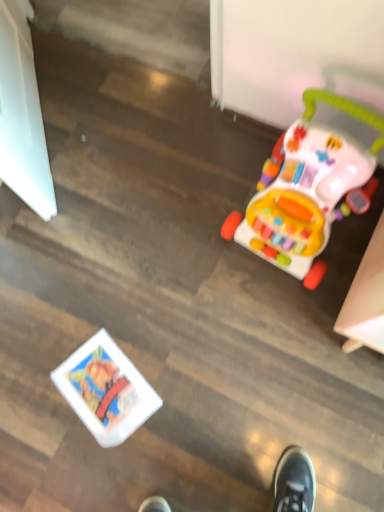
Find the location of a particular element. This screenshot has height=512, width=384. white glossy book at lower left, the 1th toy from the bottom is located at coordinates (106, 390).

Describe the element at coordinates (106, 390) in the screenshot. I see `white glossy book at lower left, the 1th toy from the bottom` at that location.

Image resolution: width=384 pixels, height=512 pixels. What are the coordinates of `multicolored plastic walker at right, which appears as the 2th toy when ordered from the bottom` in the screenshot? It's located at (308, 189).

What do you see at coordinates (308, 189) in the screenshot?
I see `multicolored plastic walker at right, the first toy from the right` at bounding box center [308, 189].

What is the approximate height of multicolored plastic walker at right, which ranks as the 2th toy in left-to-right order?

multicolored plastic walker at right, which ranks as the 2th toy in left-to-right order, is 17.11 inches tall.

You are a GUI agent. You are given a task and a screenshot of the screen. Output one action in this format:
    pyautogui.click(x=<x>, y=<y>)
    Task: Click on the white glossy book at lower left, which is the 2th toy from right to left
    
    Given the screenshot: What is the action you would take?
    pyautogui.click(x=106, y=390)

Which object is positioned more to the right, multicolored plastic walker at right, the first toy from the right, or white glossy book at lower left, the 1th toy from the bottom?

From the viewer's perspective, multicolored plastic walker at right, the first toy from the right, appears more on the right side.

Is the depth of multicolored plastic walker at right, the first toy from the right, greater than that of white glossy book at lower left, which is the 2th toy from right to left?

That is False.

Which point is more distant from viewer, (319,214) or (87,366)?

Point (87,366)

From the image's perspective, is multicolored plastic walker at right, positioned as the first toy in top-to-bottom order, on top of white glossy book at lower left, the second toy from the top?

Yes, from the image's perspective, multicolored plastic walker at right, positioned as the first toy in top-to-bottom order, is over white glossy book at lower left, the second toy from the top.

From a real-world perspective, is multicolored plastic walker at right, which ranks as the 2th toy in left-to-right order, above or below white glossy book at lower left, the second toy from the top?

multicolored plastic walker at right, which ranks as the 2th toy in left-to-right order, is situated higher than white glossy book at lower left, the second toy from the top, in the real world.

Is multicolored plastic walker at right, which appears as the 2th toy when ordered from the bottom, wider or thinner than white glossy book at lower left, the 1th toy from the bottom?

In the image, multicolored plastic walker at right, which appears as the 2th toy when ordered from the bottom, appears to be wider than white glossy book at lower left, the 1th toy from the bottom.

Between multicolored plastic walker at right, which appears as the 2th toy when ordered from the bottom, and white glossy book at lower left, which is the 2th toy from right to left, which one has less height?

Standing shorter between the two is white glossy book at lower left, which is the 2th toy from right to left.

Considering the relative sizes of multicolored plastic walker at right, the first toy from the right, and white glossy book at lower left, the second toy from the top, in the image provided, is multicolored plastic walker at right, the first toy from the right, smaller than white glossy book at lower left, the second toy from the top,?

Incorrect, multicolored plastic walker at right, the first toy from the right, is not smaller in size than white glossy book at lower left, the second toy from the top.

Can white glossy book at lower left, the second toy from the top, be found inside multicolored plastic walker at right, which appears as the 2th toy when ordered from the bottom?

No, white glossy book at lower left, the second toy from the top, is not a part of multicolored plastic walker at right, which appears as the 2th toy when ordered from the bottom.

Would you say multicolored plastic walker at right, which ranks as the 2th toy in left-to-right order, is a long distance from white glossy book at lower left, arranged as the first toy when viewed from the left?

No, multicolored plastic walker at right, which ranks as the 2th toy in left-to-right order, is in close proximity to white glossy book at lower left, arranged as the first toy when viewed from the left.

Is multicolored plastic walker at right, positioned as the first toy in top-to-bottom order, aimed at white glossy book at lower left, which is the 2th toy from right to left?

Yes, multicolored plastic walker at right, positioned as the first toy in top-to-bottom order, faces towards white glossy book at lower left, which is the 2th toy from right to left.

The height and width of the screenshot is (512, 384). In order to click on toy located underneath the multicolored plastic walker at right, which appears as the 2th toy when ordered from the bottom (from a real-world perspective) in this screenshot , I will do `click(106, 390)`.

Which object is positioned more to the left, white glossy book at lower left, the second toy from the top, or multicolored plastic walker at right, which appears as the 2th toy when ordered from the bottom?

From the viewer's perspective, white glossy book at lower left, the second toy from the top, appears more on the left side.

Considering the relative positions of white glossy book at lower left, which is the 2th toy from right to left, and multicolored plastic walker at right, positioned as the first toy in top-to-bottom order, in the image provided, is white glossy book at lower left, which is the 2th toy from right to left, behind multicolored plastic walker at right, positioned as the first toy in top-to-bottom order,?

Yes, white glossy book at lower left, which is the 2th toy from right to left, is further from the camera.

Considering the points (109, 345) and (264, 164), which point is behind, point (109, 345) or point (264, 164)?

Positioned behind is point (109, 345).

From the image's perspective, relative to multicolored plastic walker at right, the first toy from the right, is white glossy book at lower left, the 1th toy from the bottom, above or below?

Clearly, from the image's perspective, white glossy book at lower left, the 1th toy from the bottom, is below multicolored plastic walker at right, the first toy from the right.

From a real-world perspective, which is physically above, white glossy book at lower left, which is the 2th toy from right to left, or multicolored plastic walker at right, the first toy from the right?

multicolored plastic walker at right, the first toy from the right, is physically above.

In terms of width, does white glossy book at lower left, the second toy from the top, look wider or thinner when compared to multicolored plastic walker at right, positioned as the first toy in top-to-bottom order?

Clearly, white glossy book at lower left, the second toy from the top, has less width compared to multicolored plastic walker at right, positioned as the first toy in top-to-bottom order.

Considering the sizes of white glossy book at lower left, which is the 2th toy from right to left, and multicolored plastic walker at right, which ranks as the 2th toy in left-to-right order, in the image, is white glossy book at lower left, which is the 2th toy from right to left, taller or shorter than multicolored plastic walker at right, which ranks as the 2th toy in left-to-right order,?

Clearly, white glossy book at lower left, which is the 2th toy from right to left, is shorter compared to multicolored plastic walker at right, which ranks as the 2th toy in left-to-right order.

Who is smaller, white glossy book at lower left, the 1th toy from the bottom, or multicolored plastic walker at right, which appears as the 2th toy when ordered from the bottom?

white glossy book at lower left, the 1th toy from the bottom, is smaller.

Would you say white glossy book at lower left, the second toy from the top, is outside multicolored plastic walker at right, the first toy from the right?

white glossy book at lower left, the second toy from the top, is positioned outside multicolored plastic walker at right, the first toy from the right.

Is white glossy book at lower left, the second toy from the top, next to multicolored plastic walker at right, which appears as the 2th toy when ordered from the bottom?

No, white glossy book at lower left, the second toy from the top, is not making contact with multicolored plastic walker at right, which appears as the 2th toy when ordered from the bottom.

Is white glossy book at lower left, the second toy from the top, turned away from multicolored plastic walker at right, positioned as the first toy in top-to-bottom order?

white glossy book at lower left, the second toy from the top, is not turned away from multicolored plastic walker at right, positioned as the first toy in top-to-bottom order.

Where is `toy above the white glossy book at lower left, arranged as the first toy when viewed from the left (from the image's perspective)`? The image size is (384, 512). toy above the white glossy book at lower left, arranged as the first toy when viewed from the left (from the image's perspective) is located at coordinates [308, 189].

There is a white glossy book at lower left, the second toy from the top. In order to click on toy above it (from a real-world perspective) in this screenshot , I will do `click(308, 189)`.

At what (x,y) coordinates should I click in order to perform the action: click on toy below the multicolored plastic walker at right, which ranks as the 2th toy in left-to-right order (from the image's perspective). Please return your answer as a coordinate pair (x, y). The width and height of the screenshot is (384, 512). Looking at the image, I should click on (106, 390).